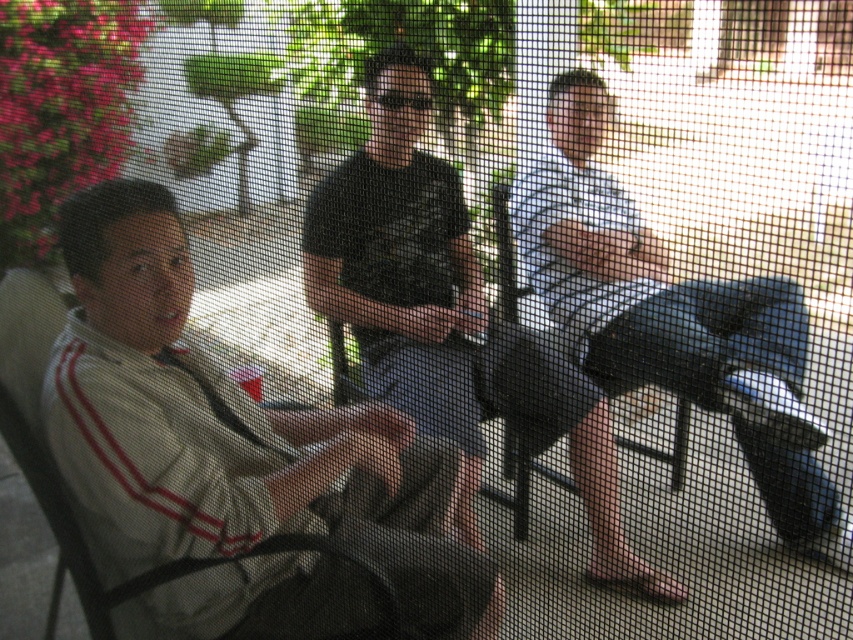
You are organizing a photo shoot and need to position two props. The white fabric jacket at left and the black plastic chair at center are already placed. According to the scene, which object is positioned to the left of the other?

The white fabric jacket at left is to the left of the black plastic chair at center.

You are standing at the camera position and see two points in the image. The first point is labeled as point (x=490, y=579) and the second is point (x=425, y=160). Which point is closer to you?

Point (x=490, y=579) is in front of point (x=425, y=160), so it is closer to you.

You are a photographer trying to capture a closeup of the black matte shirt at center and the black plastic chair at center. Which one would you need to zoom in more on to fill the frame?

The black matte shirt at center is larger in size than the black plastic chair at center, so you would need to zoom in more on the black plastic chair at center to fill the frame since it is smaller.